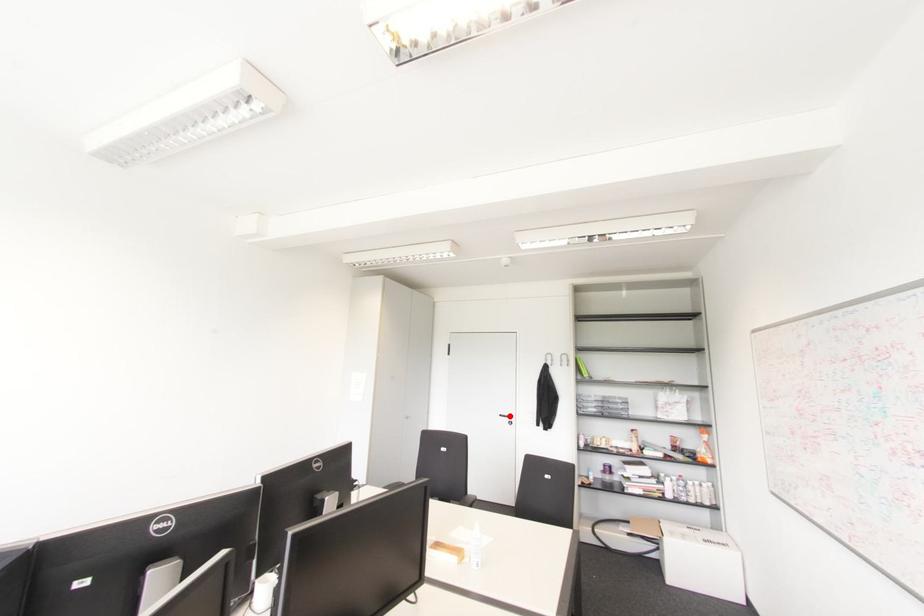
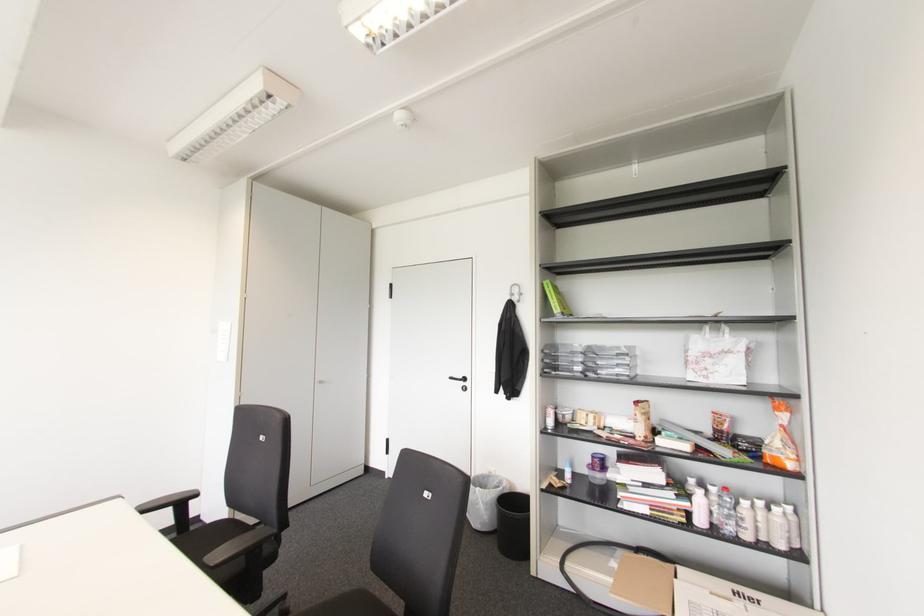
The point at the highlighted location is marked in the first image. Where is the corresponding point in the second image?

(464, 379)